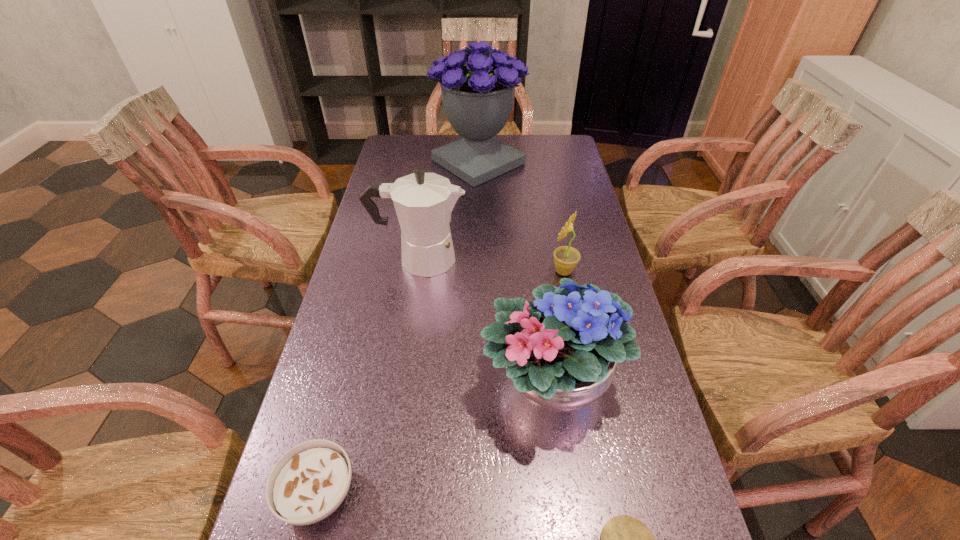
Find the location of `blank space at the far edge`. blank space at the far edge is located at coordinates (431, 161).

At what (x,y) coordinates should I click in order to perform the action: click on free spot at the left edge of the desktop. Please return your answer as a coordinate pair (x, y). The width and height of the screenshot is (960, 540). Looking at the image, I should click on (386, 367).

Where is `vacant space at the right edge of the desktop`? This screenshot has height=540, width=960. vacant space at the right edge of the desktop is located at coordinates (644, 490).

The image size is (960, 540). Find the location of `vacant space at the far left corner of the desktop`. vacant space at the far left corner of the desktop is located at coordinates (411, 156).

The image size is (960, 540). What are the coordinates of `vacant area at the far right corner` in the screenshot? It's located at (552, 154).

I want to click on free space between the nearer bouquet and the fifth shortest object, so click(485, 319).

Identify the location of blank region between the fourth tallest object and the coffeepot. (492, 265).

The image size is (960, 540). In order to click on vacant region between the fourth farthest object and the second nearest object in this screenshot , I will do `click(434, 436)`.

This screenshot has height=540, width=960. Identify the location of free space between the shortest object and the tallest object. (398, 328).

I want to click on object that is the fifth closest one to the hourglass, so click(478, 83).